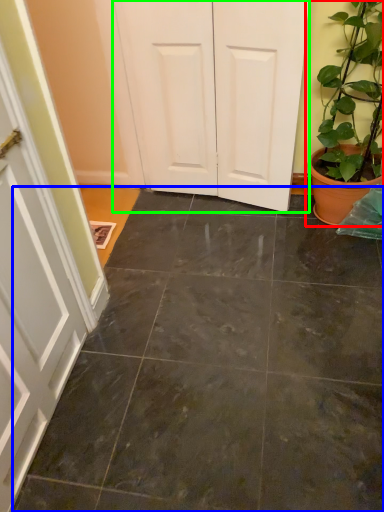
Question: Considering the real-world distances, which object is farthest from houseplant (highlighted by a red box)? concrete (highlighted by a blue box) or door (highlighted by a green box)?

Choices:
 (A) concrete
 (B) door

Answer: (A)